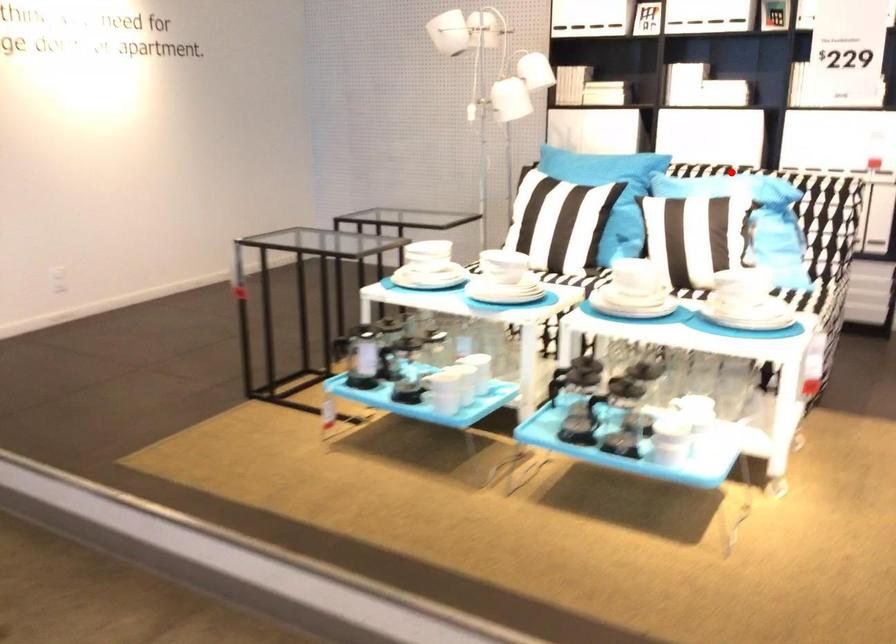
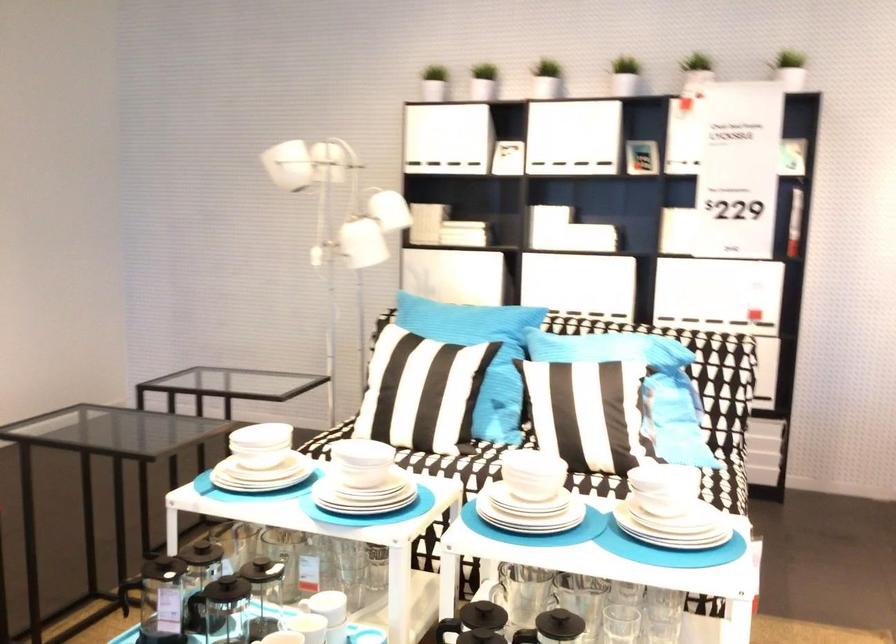
Locate, in the second image, the point that corresponds to the highlighted location in the first image.

(615, 345)